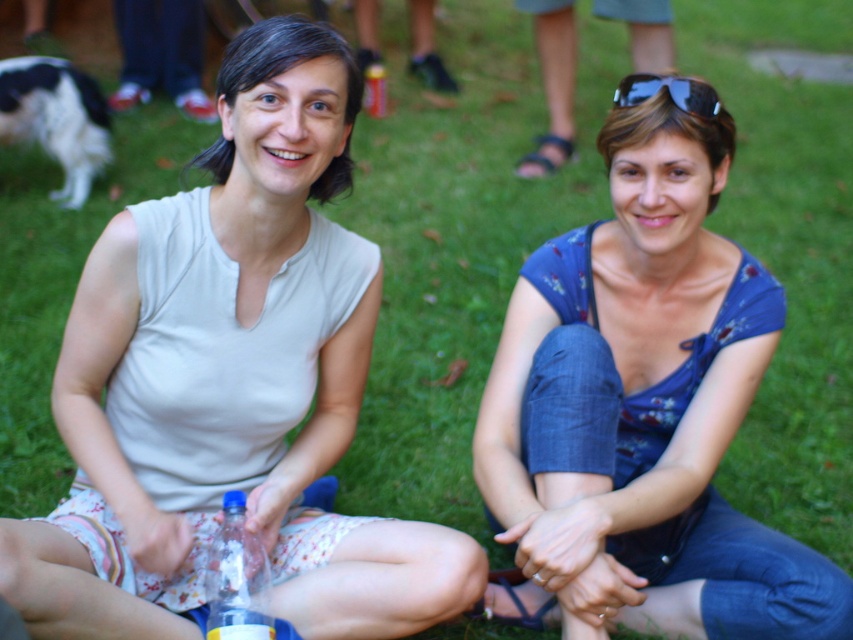
Question: Can you confirm if white cotton tank top at center is positioned above translucent plastic bottle at center?

Choices:
 (A) no
 (B) yes

Answer: (B)

Question: Which point is closer to the camera?

Choices:
 (A) (689, 80)
 (B) (213, 577)

Answer: (B)

Question: Which of the following is the farthest from the observer?

Choices:
 (A) blue floral dress at center
 (B) black and white fur at upper left

Answer: (B)

Question: Is white cotton tank top at center positioned behind black reflective sunglasses at upper right?

Choices:
 (A) no
 (B) yes

Answer: (A)

Question: Among these points, which one is nearest to the camera?

Choices:
 (A) (764, 593)
 (B) (102, 572)
 (C) (712, 116)

Answer: (B)

Question: Is translucent plastic bottle at center bigger than black reflective sunglasses at upper right?

Choices:
 (A) yes
 (B) no

Answer: (A)